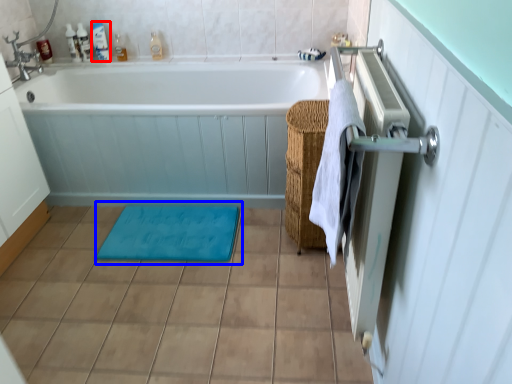
Question: Which of the following is the farthest to the observer, toiletry (highlighted by a red box) or bath mat (highlighted by a blue box)?

Choices:
 (A) toiletry
 (B) bath mat

Answer: (A)